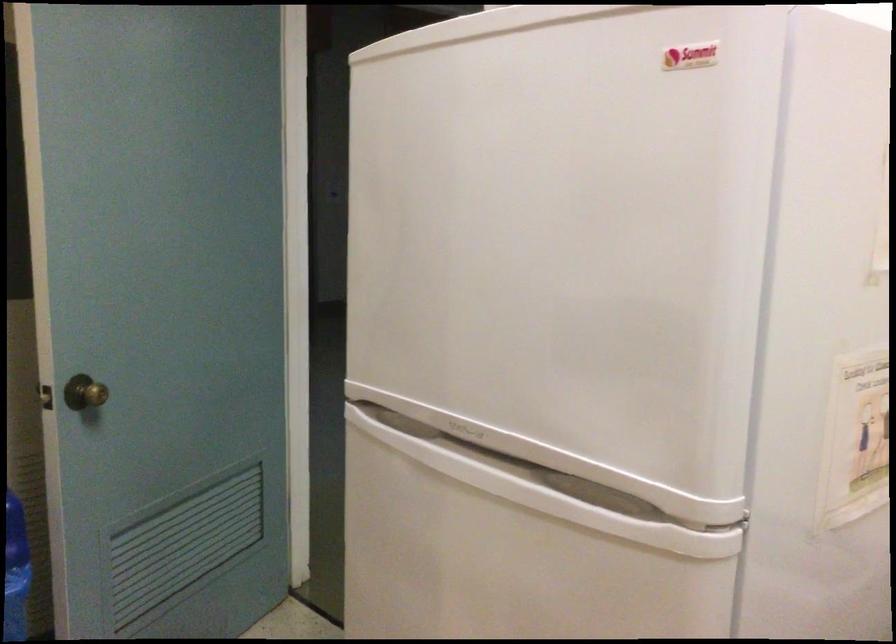
Find the location of `brass doorknob`. brass doorknob is located at coordinates (85, 393).